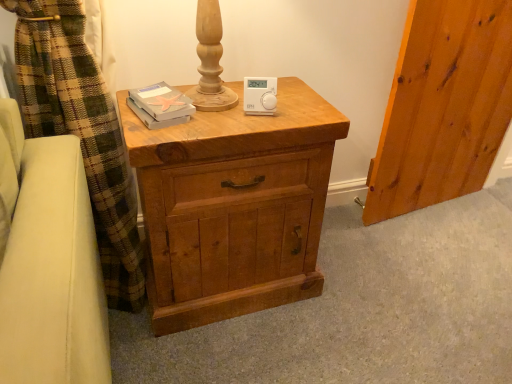
Locate an element on the screen. This screenshot has height=384, width=512. vacant area to the right of white plastic thermostat at center is located at coordinates (298, 106).